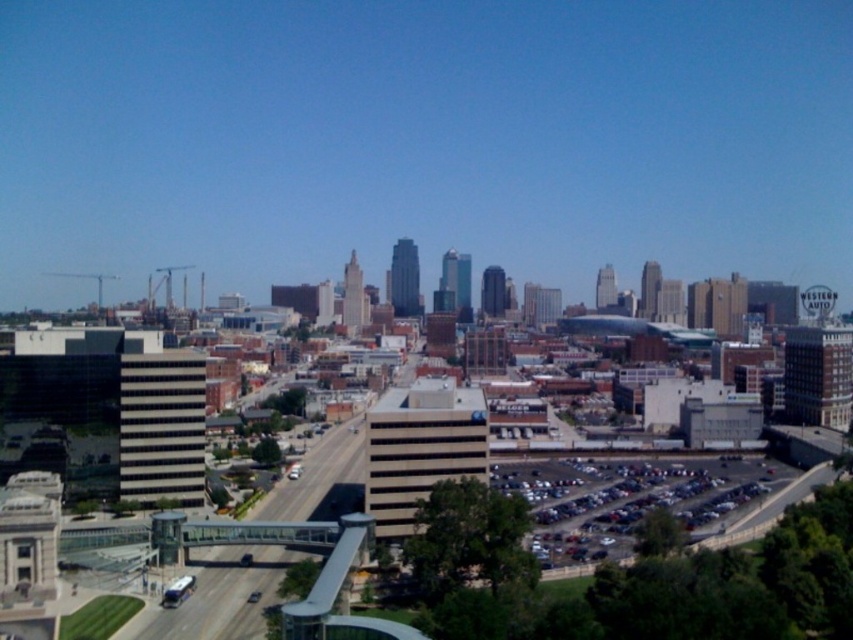
Question: Does smooth concrete highway at center have a larger size compared to metallic gray cars at lower right?

Choices:
 (A) yes
 (B) no

Answer: (B)

Question: Which object appears farthest from the camera in this image?

Choices:
 (A) smooth concrete highway at center
 (B) metallic gray cars at lower right

Answer: (B)

Question: Which point is closer to the camera taking this photo?

Choices:
 (A) (312, 467)
 (B) (508, 468)

Answer: (A)

Question: Does smooth concrete highway at center come behind metallic gray cars at lower right?

Choices:
 (A) yes
 (B) no

Answer: (B)

Question: Does smooth concrete highway at center have a smaller size compared to metallic gray cars at lower right?

Choices:
 (A) yes
 (B) no

Answer: (A)